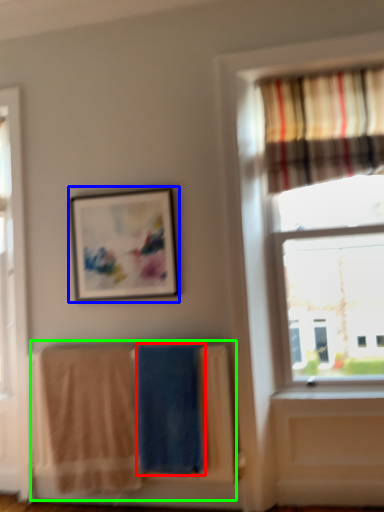
Question: Based on their relative distances, which object is farther from beach towel (highlighted by a red box)? Choose from picture frame (highlighted by a blue box) and laundry (highlighted by a green box).

Choices:
 (A) picture frame
 (B) laundry

Answer: (A)